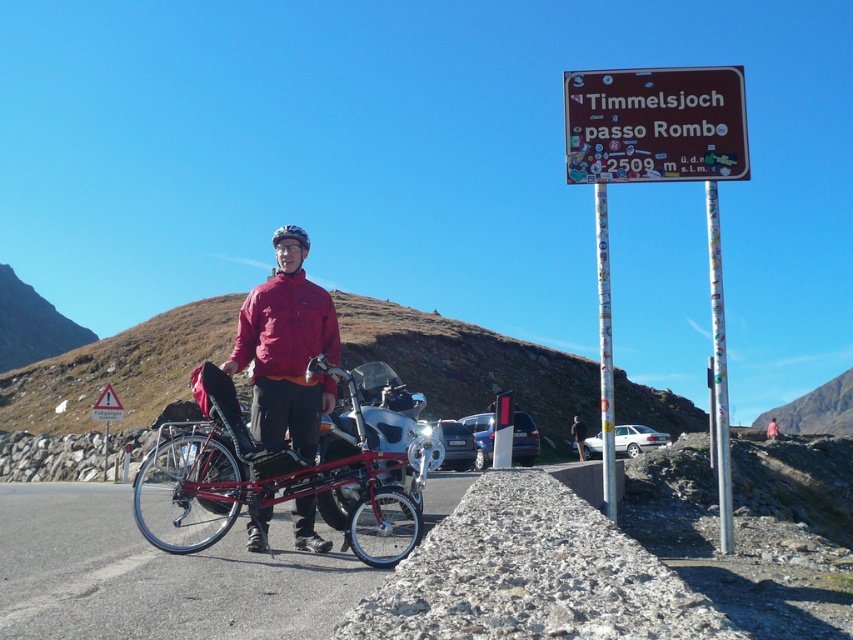
You are a hiker who wants to take a photo of the pink fabric jacket at center and the yellow reflective triangle at upper left. Which object should you focus on first if you want to capture both in a single frame without moving your camera?

The yellow reflective triangle at upper left is located above the pink fabric jacket at center, so you should focus on the yellow reflective triangle at upper left first to ensure both objects are in the frame.

In the scene shown: You are a hiker who wants to take a photo of the shiny metallic bicycle at center. You have a camera with a 50mm lens. The camera can focus on objects within 2 meters. You are currently standing at point (265, 477). Is the bicycle within your camera focus range?

The shiny metallic bicycle at center is located at point (265, 477), which is where you are standing. Therefore, the distance between you and the bicycle is zero, so it is well within the camera focus range of 2 meters.

You are a photographer trying to capture the perfect shot of the shiny metallic bicycle at center. The camera you are using has a focal length of 50mm. If you want to focus on the bicycle, which object in the scene should you avoid moving since it is at the same focal plane?

The shiny metallic bicycle at center is at point (265, 477), so you should avoid moving the shiny metallic bicycle at center since it is the focal point.